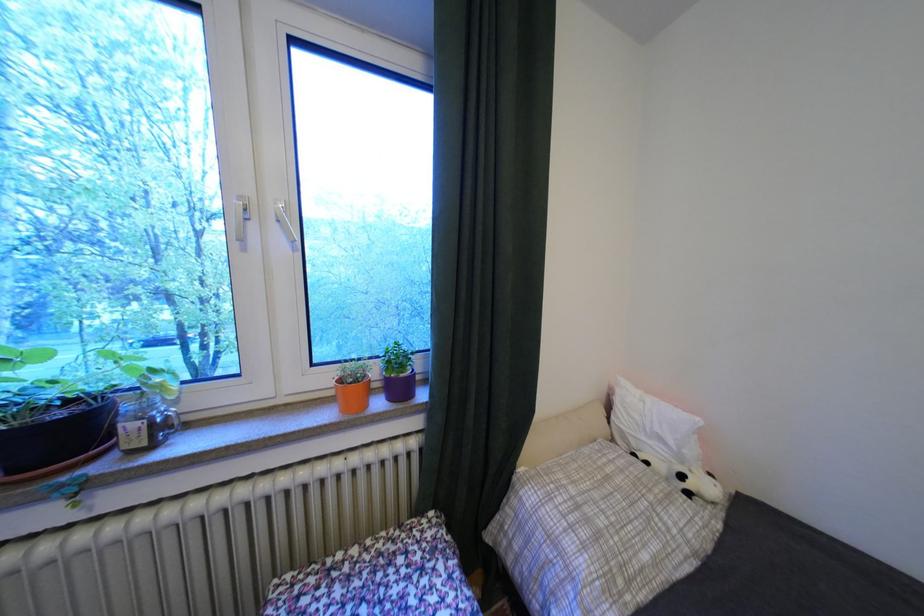
Where is `purple flower pot`? The image size is (924, 616). purple flower pot is located at coordinates [x=45, y=415].